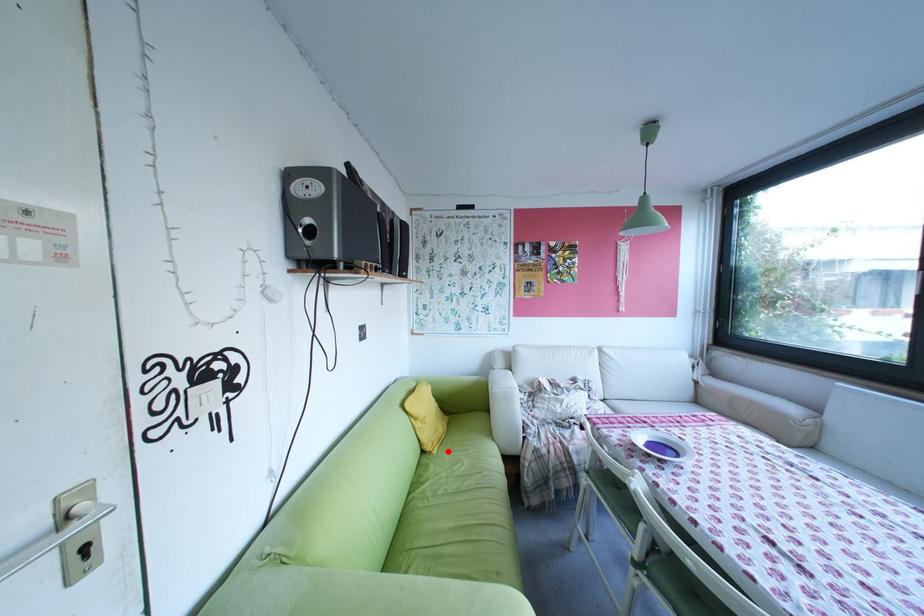
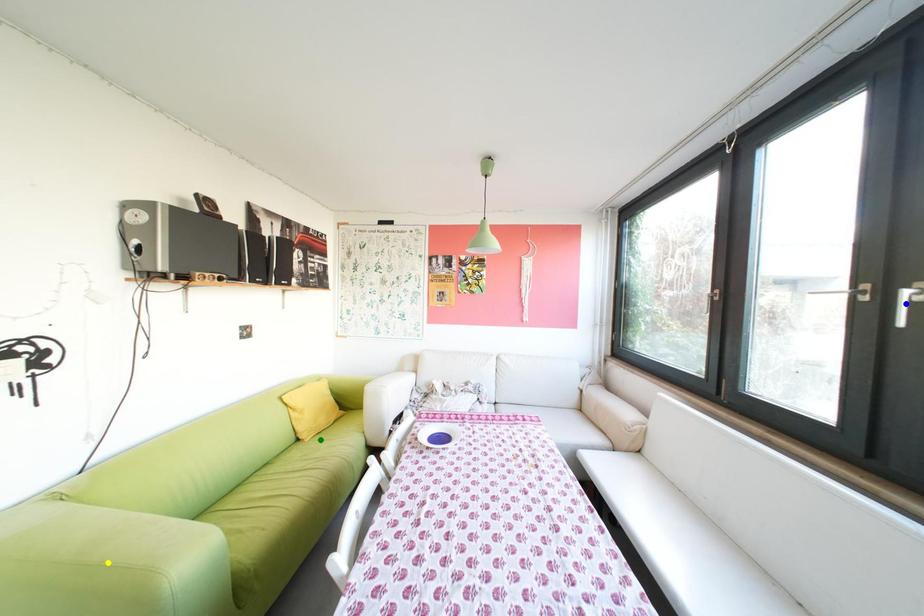
Question: I am providing you with two images of the same scene from different viewpoints. A red point is marked on the first image. You are given multiple points on the second image. In image 2, which mark is for the same physical point as the one in image 1?

Choices:
 (A) green point
 (B) yellow point
 (C) blue point

Answer: (A)